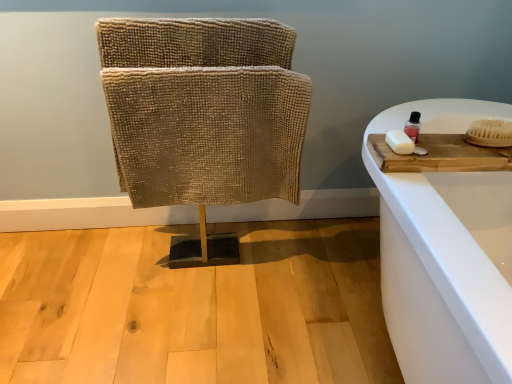
Image resolution: width=512 pixels, height=384 pixels. I want to click on free region on the left part of beige textured fabric at center, so click(x=87, y=271).